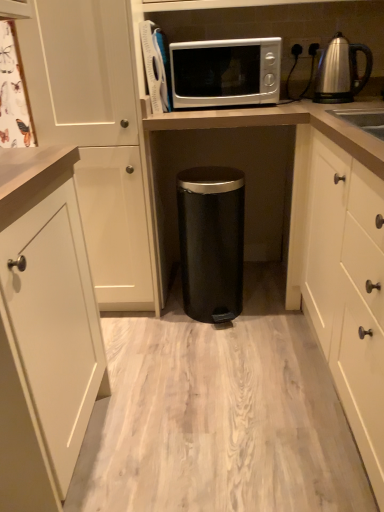
Find the location of a particular element. The width and height of the screenshot is (384, 512). free spot in front of white matte cabinet at left, marked as the 2th cabinetry in a right-to-left arrangement is located at coordinates (156, 343).